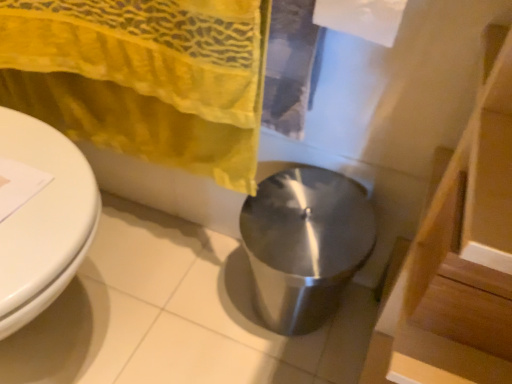
Describe the element at coordinates (144, 77) in the screenshot. I see `yellow sheer fabric at upper left` at that location.

Locate an element on the screen. yellow sheer fabric at upper left is located at coordinates tap(144, 77).

Locate an element on the screen. The image size is (512, 384). yellow sheer fabric at upper left is located at coordinates (144, 77).